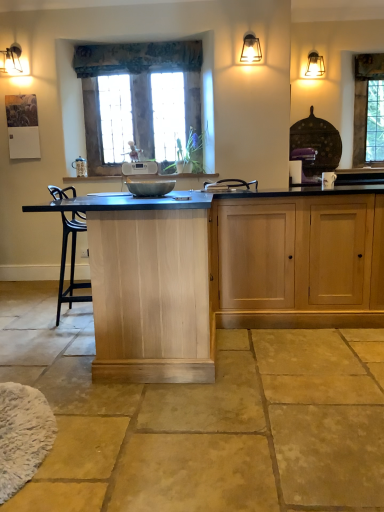
Question: Considering the relative positions of clear glass window at upper right, the 1th window in the back-to-front sequence, and natural stone floor at center in the image provided, is clear glass window at upper right, the 1th window in the back-to-front sequence, in front of natural stone floor at center?

Choices:
 (A) no
 (B) yes

Answer: (A)

Question: Does clear glass window at upper right, the second window when ordered from left to right, have a larger size compared to natural stone floor at center?

Choices:
 (A) no
 (B) yes

Answer: (A)

Question: From the image's perspective, does clear glass window at upper right, the second window when ordered from left to right, appear lower than natural stone floor at center?

Choices:
 (A) no
 (B) yes

Answer: (A)

Question: Is clear glass window at upper right, the second window when ordered from left to right, behind natural stone floor at center?

Choices:
 (A) yes
 (B) no

Answer: (A)

Question: Does clear glass window at upper right, marked as the 2th window in a front-to-back arrangement, have a greater height compared to natural stone floor at center?

Choices:
 (A) yes
 (B) no

Answer: (A)

Question: From a real-world perspective, is textured fabric curtain at upper center positioned above or below white fluffy mat at lower left?

Choices:
 (A) below
 (B) above

Answer: (B)

Question: From the image's perspective, relative to white fluffy mat at lower left, is textured fabric curtain at upper center above or below?

Choices:
 (A) above
 (B) below

Answer: (A)

Question: In terms of width, does textured fabric curtain at upper center look wider or thinner when compared to white fluffy mat at lower left?

Choices:
 (A) wide
 (B) thin

Answer: (B)

Question: In terms of height, does textured fabric curtain at upper center look taller or shorter compared to white fluffy mat at lower left?

Choices:
 (A) short
 (B) tall

Answer: (B)

Question: From a real-world perspective, is light wood cabinet at center physically located above or below clear glass window at upper right, the 1th window in the back-to-front sequence?

Choices:
 (A) above
 (B) below

Answer: (B)

Question: Based on their positions, is light wood cabinet at center located to the left or right of clear glass window at upper right, the second window when ordered from left to right?

Choices:
 (A) left
 (B) right

Answer: (A)

Question: Considering the positions of light wood cabinet at center and clear glass window at upper right, the 1th window in the right-to-left sequence, in the image, is light wood cabinet at center bigger or smaller than clear glass window at upper right, the 1th window in the right-to-left sequence,?

Choices:
 (A) small
 (B) big

Answer: (B)

Question: Considering their positions, is light wood cabinet at center located in front of or behind clear glass window at upper right, marked as the 2th window in a front-to-back arrangement?

Choices:
 (A) front
 (B) behind

Answer: (A)

Question: From the image's perspective, is textured fabric curtain at upper center above or below matte black wall sconce at upper right?

Choices:
 (A) above
 (B) below

Answer: (A)

Question: Is textured fabric curtain at upper center taller or shorter than matte black wall sconce at upper right?

Choices:
 (A) tall
 (B) short

Answer: (A)